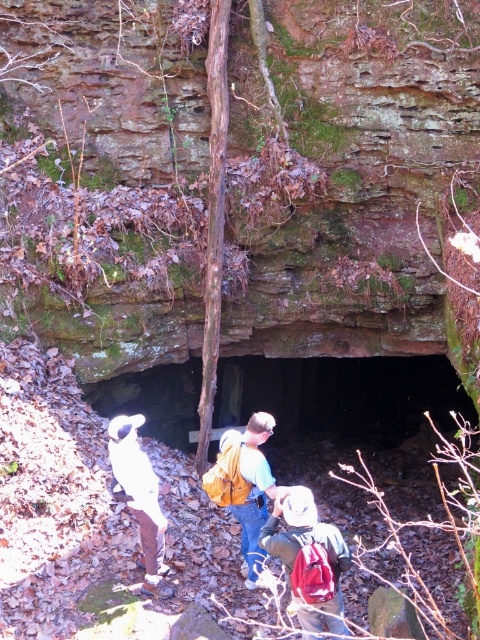
Is point (312, 596) positioned in front of point (129, 426)?

Yes.

Which is behind, point (279, 556) or point (120, 452)?

The point (120, 452) is behind.

Which is in front, point (312, 621) or point (135, 417)?

Positioned in front is point (312, 621).

Locate an element on the screen. Image resolution: width=480 pixels, height=640 pixels. green fabric backpack at center is located at coordinates (310, 560).

I want to click on green fabric backpack at center, so click(310, 560).

How distant is green fabric backpack at center from yellow backpack at center?

The distance of green fabric backpack at center from yellow backpack at center is 33.06 inches.

Is point (335, 570) more distant than point (229, 436)?

No, (335, 570) is closer to viewer.

The width and height of the screenshot is (480, 640). I want to click on green fabric backpack at center, so click(310, 560).

Identify the location of yellow backpack at center. This screenshot has width=480, height=640. (244, 484).

The width and height of the screenshot is (480, 640). I want to click on yellow backpack at center, so click(244, 484).